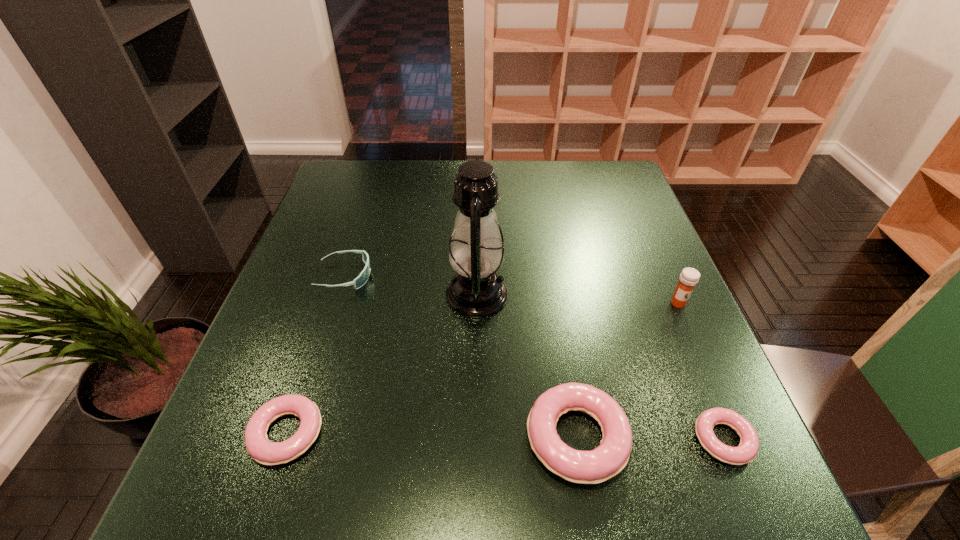
To ensure equal spacing by inserting another doughnut among them, please point out a vacant spot for this new doughnut. Please provide its 2D coordinates. Your answer should be formatted as a tuple, i.e. [(x, y)], where the tuple contains the x and y coordinates of a point satisfying the conditions above.

[(431, 436)]